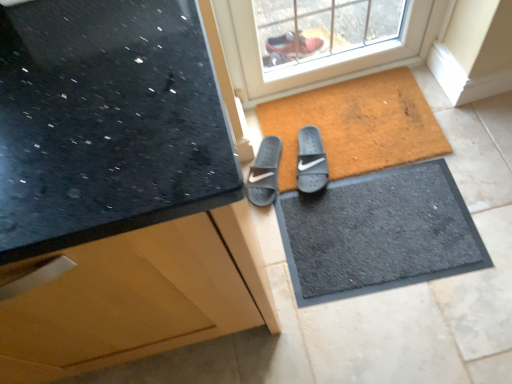
Locate an element on the screen. The height and width of the screenshot is (384, 512). empty space that is ontop of gray rubber slide at center, the 1th footwear in the right-to-left sequence (from a real-world perspective) is located at coordinates (309, 163).